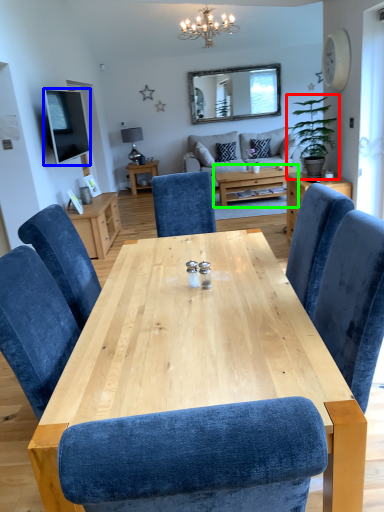
Question: Based on their relative distances, which object is nearer to houseplant (highlighted by a red box)? Choose from television (highlighted by a blue box) and coffee table (highlighted by a green box).

Choices:
 (A) television
 (B) coffee table

Answer: (B)